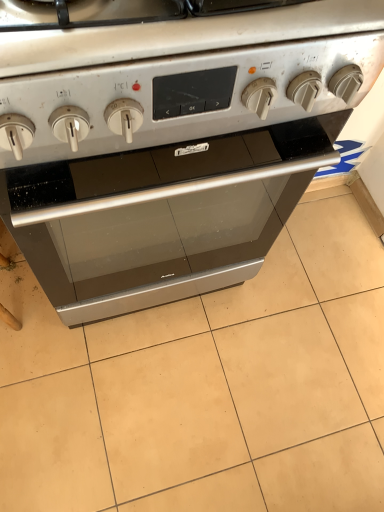
Describe the element at coordinates (208, 386) in the screenshot. I see `matte silver oven at center` at that location.

What is the approximate width of matte silver oven at center?

matte silver oven at center is 1.22 meters wide.

Find the location of a particular element. matte silver oven at center is located at coordinates (208, 386).

Measure the distance between point [40,498] and camera.

Point [40,498] is 37.56 inches away from camera.

Where is `satin silver oven at center`? satin silver oven at center is located at coordinates (171, 144).

Describe the element at coordinates (171, 144) in the screenshot. I see `satin silver oven at center` at that location.

The height and width of the screenshot is (512, 384). Find the location of `matte silver oven at center`. matte silver oven at center is located at coordinates (208, 386).

Consider the image. Is satin silver oven at center at the right side of matte silver oven at center?

No, satin silver oven at center is not to the right of matte silver oven at center.

In the image, is satin silver oven at center positioned in front of or behind matte silver oven at center?

Clearly, satin silver oven at center is in front of matte silver oven at center.

Considering the points (147, 22) and (201, 352), which point is behind, point (147, 22) or point (201, 352)?

Point (201, 352)

From the image's perspective, which object appears higher, satin silver oven at center or matte silver oven at center?

satin silver oven at center appears higher in the image.

From a real-world perspective, is satin silver oven at center located higher than matte silver oven at center?

Yes, from a real-world perspective, satin silver oven at center is above matte silver oven at center.

Considering the relative sizes of satin silver oven at center and matte silver oven at center in the image provided, is satin silver oven at center wider than matte silver oven at center?

Incorrect, the width of satin silver oven at center does not surpass that of matte silver oven at center.

Does satin silver oven at center have a lesser height compared to matte silver oven at center?

No, satin silver oven at center is not shorter than matte silver oven at center.

Which of these two, satin silver oven at center or matte silver oven at center, is bigger?

With larger size is satin silver oven at center.

Is satin silver oven at center situated inside matte silver oven at center or outside?

satin silver oven at center is outside matte silver oven at center.

Is satin silver oven at center placed right next to matte silver oven at center?

No, satin silver oven at center is not in contact with matte silver oven at center.

Is satin silver oven at center oriented away from matte silver oven at center?

satin silver oven at center does not have its back to matte silver oven at center.

The height and width of the screenshot is (512, 384). What are the coordinates of `oven on the left of matte silver oven at center` in the screenshot? It's located at (171, 144).

Visually, is matte silver oven at center positioned to the left or to the right of satin silver oven at center?

Based on their positions, matte silver oven at center is located to the right of satin silver oven at center.

Which object is more forward, matte silver oven at center or satin silver oven at center?

Positioned in front is satin silver oven at center.

Between point (175, 450) and point (178, 188), which one is positioned in front?

The point (178, 188) is in front.

From the image's perspective, is matte silver oven at center above satin silver oven at center?

No, from the image's perspective, matte silver oven at center is not over satin silver oven at center.

From a real-world perspective, is matte silver oven at center over satin silver oven at center?

No, from a real-world perspective, matte silver oven at center is not on top of satin silver oven at center.

Is matte silver oven at center thinner than satin silver oven at center?

No.

Which of these two, matte silver oven at center or satin silver oven at center, stands taller?

satin silver oven at center.

Is matte silver oven at center smaller than satin silver oven at center?

Correct, matte silver oven at center occupies less space than satin silver oven at center.

Would you say satin silver oven at center is part of matte silver oven at center's contents?

No, satin silver oven at center is not a part of matte silver oven at center.

Is matte silver oven at center beside satin silver oven at center?

No.

Is matte silver oven at center positioned with its back to satin silver oven at center?

No, matte silver oven at center's orientation is not away from satin silver oven at center.

Can you tell me how much matte silver oven at center and satin silver oven at center differ in facing direction?

matte silver oven at center and satin silver oven at center are facing 90.4 degrees away from each other.

Identify the location of tile below the satin silver oven at center (from a real-world perspective). The width and height of the screenshot is (384, 512). (208, 386).

This screenshot has height=512, width=384. Identify the location of tile on the right of satin silver oven at center. (208, 386).

Identify the location of oven in front of the matte silver oven at center. (171, 144).